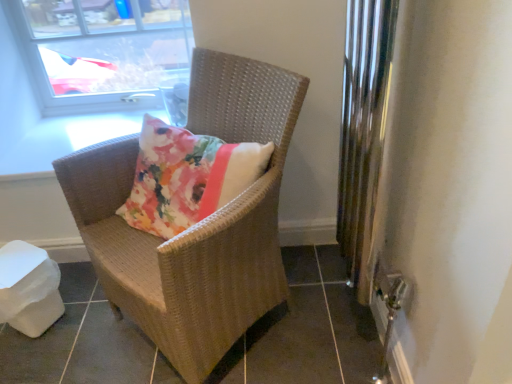
Question: Does transparent glass window at upper left have a greater width compared to woven brown chair at center?

Choices:
 (A) no
 (B) yes

Answer: (A)

Question: Is transparent glass window at upper left closer to camera compared to woven brown chair at center?

Choices:
 (A) no
 (B) yes

Answer: (A)

Question: Does transparent glass window at upper left have a lesser width compared to woven brown chair at center?

Choices:
 (A) no
 (B) yes

Answer: (B)

Question: Is transparent glass window at upper left outside of woven brown chair at center?

Choices:
 (A) no
 (B) yes

Answer: (B)

Question: From a real-world perspective, is transparent glass window at upper left below woven brown chair at center?

Choices:
 (A) yes
 (B) no

Answer: (B)

Question: Is transparent glass window at upper left at the right side of woven brown chair at center?

Choices:
 (A) no
 (B) yes

Answer: (A)

Question: Is woven brown chair at center thinner than transparent glass window at upper left?

Choices:
 (A) no
 (B) yes

Answer: (A)

Question: Is there a large distance between woven brown chair at center and transparent glass window at upper left?

Choices:
 (A) no
 (B) yes

Answer: (A)

Question: From the image's perspective, is woven brown chair at center under transparent glass window at upper left?

Choices:
 (A) no
 (B) yes

Answer: (B)

Question: Is woven brown chair at center outside transparent glass window at upper left?

Choices:
 (A) no
 (B) yes

Answer: (B)

Question: Is woven brown chair at center in front of transparent glass window at upper left?

Choices:
 (A) no
 (B) yes

Answer: (B)

Question: Is woven brown chair at center beside transparent glass window at upper left?

Choices:
 (A) no
 (B) yes

Answer: (A)

Question: Considering the positions of woven brown chair at center and transparent glass window at upper left in the image, is woven brown chair at center wider or thinner than transparent glass window at upper left?

Choices:
 (A) wide
 (B) thin

Answer: (A)